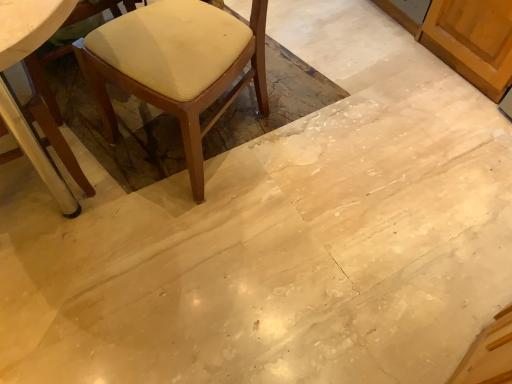
Image resolution: width=512 pixels, height=384 pixels. Find the location of `free area in between matte beige cushioned chair at left, arranged as the first chair when viewed from the right, and wooden chair at left, which is the 2th chair in right-to-left order`. free area in between matte beige cushioned chair at left, arranged as the first chair when viewed from the right, and wooden chair at left, which is the 2th chair in right-to-left order is located at coordinates (118, 172).